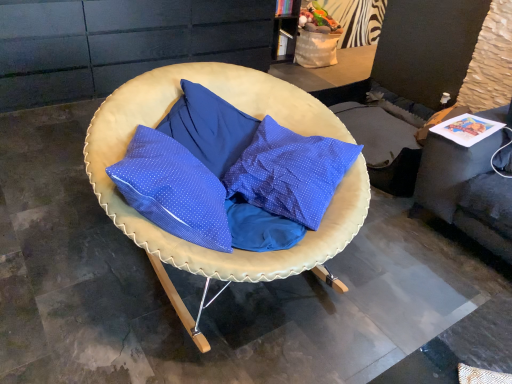
Where is `leather cushioned chair at center`? This screenshot has width=512, height=384. leather cushioned chair at center is located at coordinates (252, 116).

This screenshot has height=384, width=512. What do you see at coordinates (252, 116) in the screenshot?
I see `leather cushioned chair at center` at bounding box center [252, 116].

Where is `leather cushioned chair at center`? The width and height of the screenshot is (512, 384). leather cushioned chair at center is located at coordinates (252, 116).